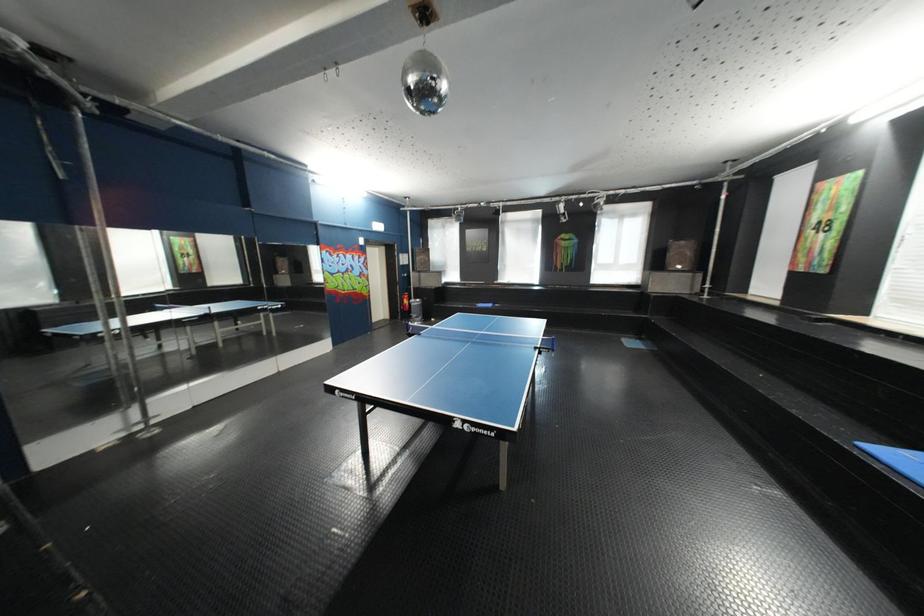
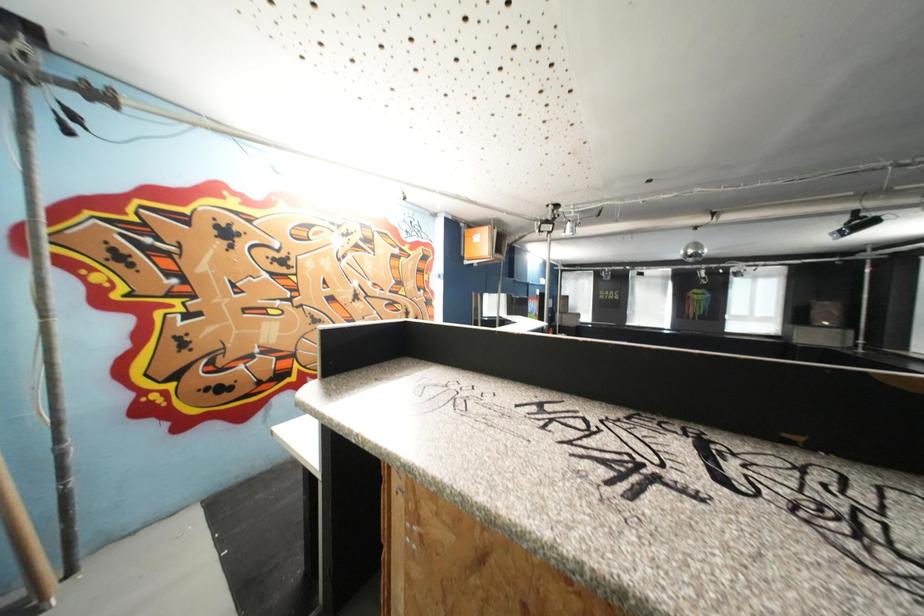
The images are taken continuously from a first-person perspective. In which direction are you moving?

The cameraman moved toward left, backward.